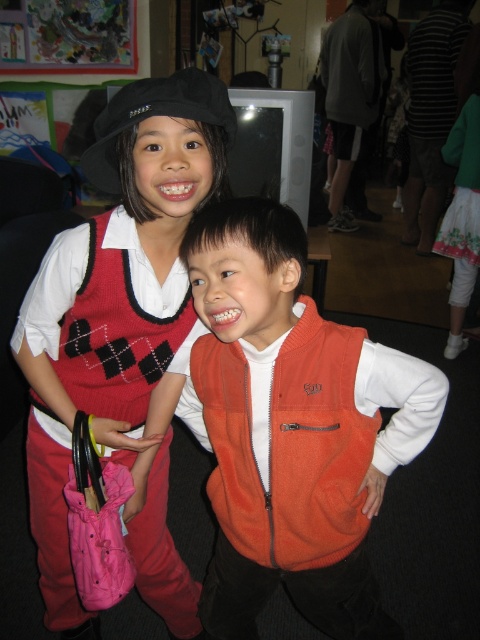
Where is the knitted sweater vest at center located in the image?

The knitted sweater vest at center is located at point coordinates of (122, 333).

You are a tailor measuring the distance between two knitted sweater vests in a store display. The knitted sweater vest at center and knitted argyle sweater vest at left are part of a winter collection. If your measuring tape shows 2.30 inches between them, is this enough space for a customer to comfortably touch both vests without moving the display?

The knitted sweater vest at center and knitted argyle sweater vest at left are 2.30 inches apart from each other. This distance may be slightly tight for a customer to comfortably touch both vests without moving the display, as 2.30 inches is a narrow gap for interaction.